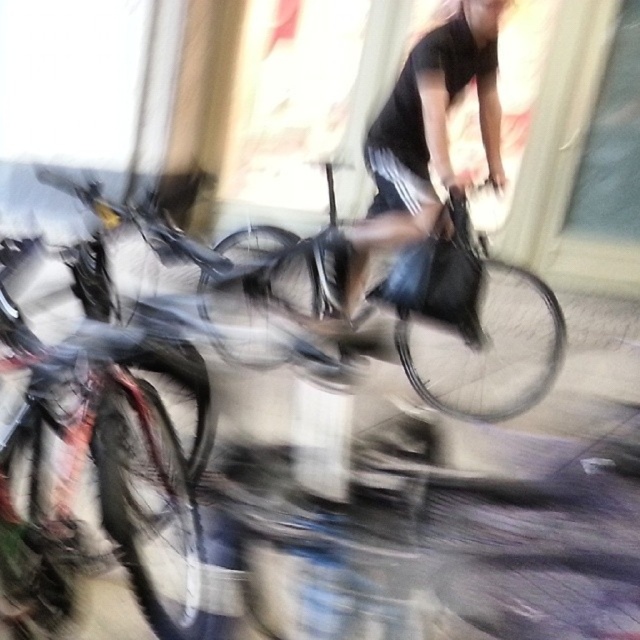
Where is `shiny metallic bicycle at left`? This screenshot has height=640, width=640. shiny metallic bicycle at left is located at coordinates (104, 497).

What do you see at coordinates (104, 497) in the screenshot?
I see `shiny metallic bicycle at left` at bounding box center [104, 497].

The width and height of the screenshot is (640, 640). Identify the location of shiny metallic bicycle at left. (104, 497).

Between shiny metallic bicycle at left and black matte bag at center, which one has more height?

Standing taller between the two is black matte bag at center.

Is shiny metallic bicycle at left positioned before black matte bag at center?

Yes, it is in front of black matte bag at center.

I want to click on shiny metallic bicycle at left, so click(104, 497).

Describe the element at coordinates (472, 324) in the screenshot. I see `shiny metallic bicycle at center` at that location.

In the scene shown: Does shiny metallic bicycle at center have a greater width compared to black matte bag at center?

Indeed, shiny metallic bicycle at center has a greater width compared to black matte bag at center.

Between point (492, 337) and point (392, 230), which one is positioned in front?

Point (392, 230) is in front.

Identify the location of shiny metallic bicycle at center. The image size is (640, 640). (472, 324).